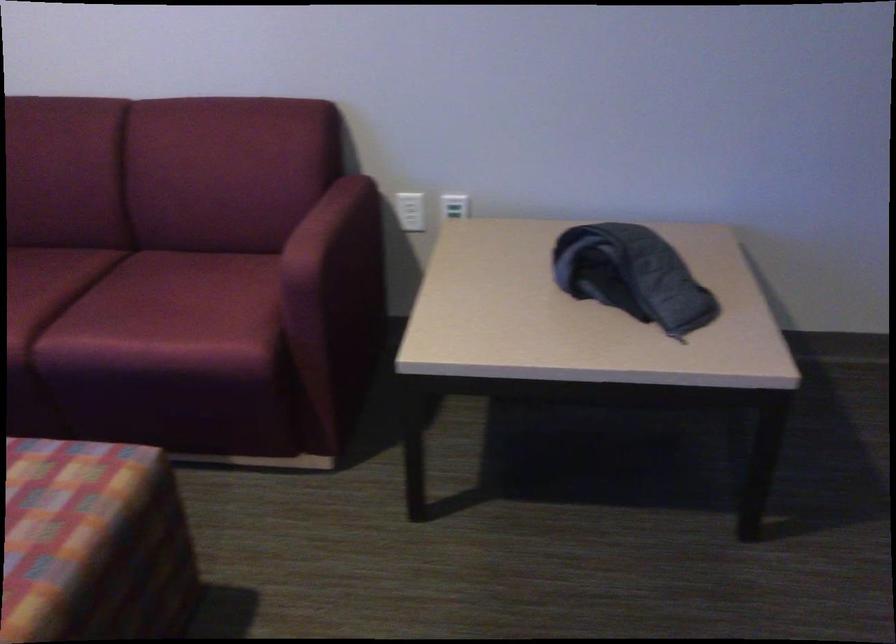
You are a GUI agent. You are given a task and a screenshot of the screen. Output one action in this format:
    pyautogui.click(x=<x>, y=<y>)
    Task: Click on the sofa armrest
    This screenshot has height=644, width=896.
    Given the screenshot: What is the action you would take?
    pyautogui.click(x=334, y=259)